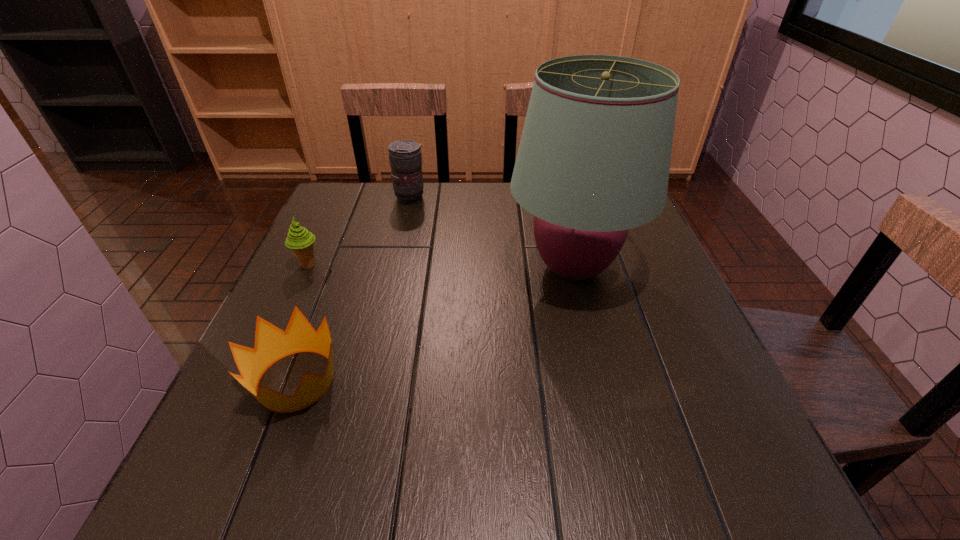
Identify the location of vacant space that satisfies the following two spatial constraints: 1. on the side of the telephoto lens where the control switches are located; 2. on the front side of the nearest object. (369, 380).

At what (x,y) coordinates should I click in order to perform the action: click on vacant position in the image that satisfies the following two spatial constraints: 1. on the back side of the shortest object; 2. on the right side of the lampshade. Please return your answer as a coordinate pair (x, y). The height and width of the screenshot is (540, 960). Looking at the image, I should click on (339, 268).